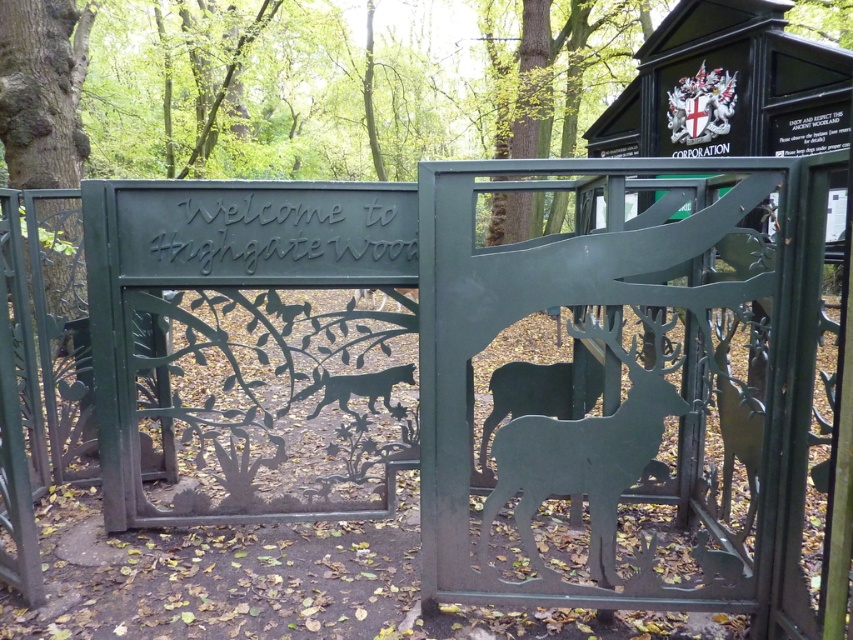
Question: Which of the following is the farthest from the observer?

Choices:
 (A) green metal gate at right
 (B) black embossed text at center
 (C) green metal sign at upper right
 (D) silhouette metal wolf at center

Answer: (C)

Question: Which is nearer to the black embossed text at center?

Choices:
 (A) silhouette metal wolf at center
 (B) green metal sign at upper right
 (C) black matte deer at center
 (D) green matte deer at center

Answer: (A)

Question: Is green matte deer at center wider than green metal gate at right?

Choices:
 (A) yes
 (B) no

Answer: (A)

Question: Where is green metal gate at right located in relation to black matte deer at center in the image?

Choices:
 (A) right
 (B) left

Answer: (A)

Question: Is black embossed text at center further to the viewer compared to green matte deer at center?

Choices:
 (A) yes
 (B) no

Answer: (A)

Question: Which of the following is the farthest from the observer?

Choices:
 (A) black embossed text at center
 (B) green metal gate at right

Answer: (A)